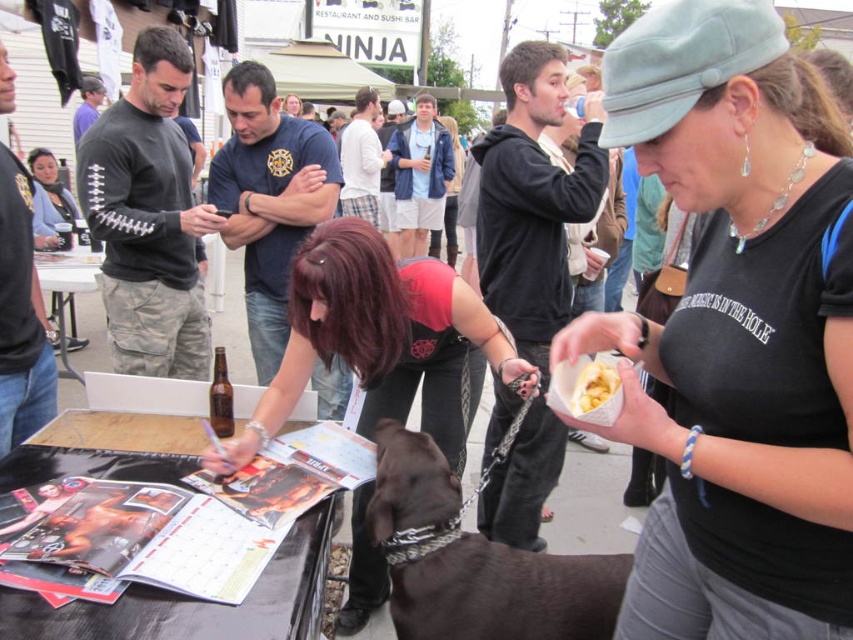
Question: Among these points, which one is farthest from the camera?

Choices:
 (A) (329, 326)
 (B) (583, 369)
 (C) (724, 234)
 (D) (451, 515)

Answer: (A)

Question: Which point is closer to the camera?

Choices:
 (A) shiny black shirt at center
 (B) yellow crumbly food at center

Answer: (B)

Question: Does shiny black shirt at center appear under dark brown fur at center?

Choices:
 (A) no
 (B) yes

Answer: (A)

Question: Which point is farther to the camera?

Choices:
 (A) yellow crumbly food at center
 (B) matte black shirt at center
 (C) dark brown fur at center

Answer: (C)

Question: Is dark brown fur at center to the right of yellow crumbly food at center from the viewer's perspective?

Choices:
 (A) yes
 (B) no

Answer: (B)

Question: Does shiny black shirt at center have a greater width compared to dark brown fur at center?

Choices:
 (A) yes
 (B) no

Answer: (A)